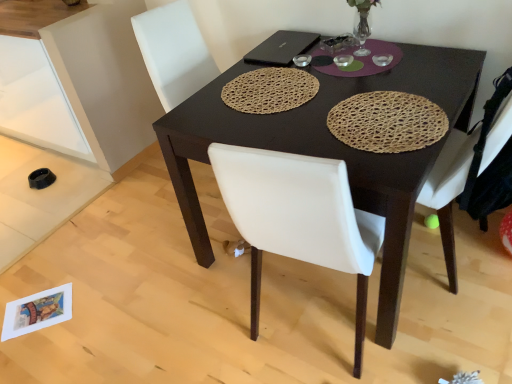
The height and width of the screenshot is (384, 512). I want to click on unoccupied space behind woven straw placemat at center, marked as the first mat in a right-to-left arrangement, so click(x=358, y=76).